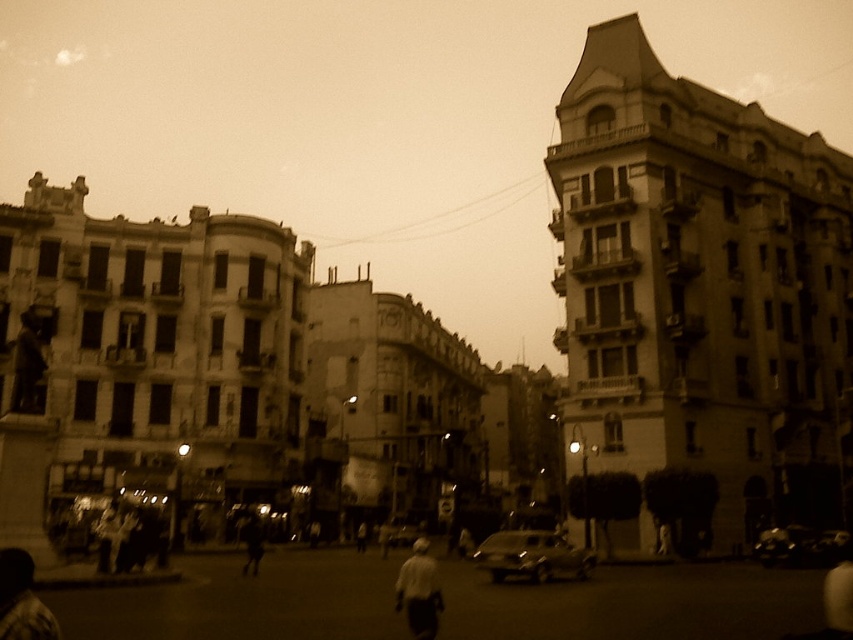
You are a photographer standing in the middle of the street. You notice two people in the scene, the dark textured clothing at lower left and the white matte shirt at center. Which person is shorter?

The dark textured clothing at lower left is shorter than the white matte shirt at center.

You are a pedestrian standing on the street and want to cross to the other side. There are two cars in the center of the image, a metallic silver car at center and a shiny black car at center. Which car is closer to you?

The metallic silver car at center is closer to you because it is in front of the shiny black car at center.

You are a photographer trying to capture a shot of both the dark textured clothing at lower left and the white matte shirt at center. Based on their positions and sizes, which one would appear larger in your photo?

The dark textured clothing at lower left might appear larger than the white matte shirt at center because it is wider.